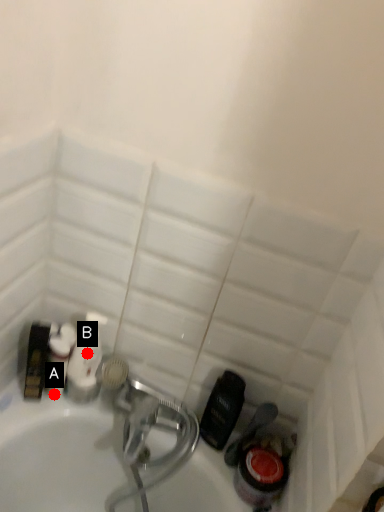
Question: Two points are circled on the image, labeled by A and B beside each circle. Which point appears closest to the camera in this image?

Choices:
 (A) A is closer
 (B) B is closer

Answer: (B)